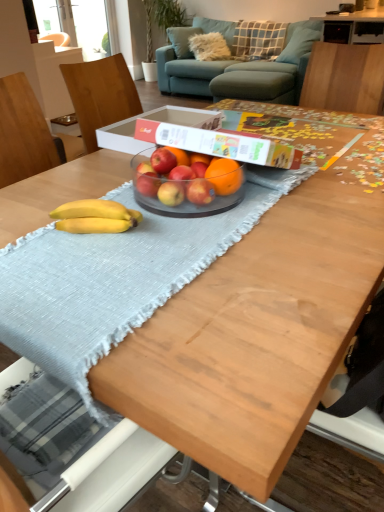
Where is `free space in front of red matte apple at center, acting as the 5th apple starting from the right`? The width and height of the screenshot is (384, 512). free space in front of red matte apple at center, acting as the 5th apple starting from the right is located at coordinates (145, 226).